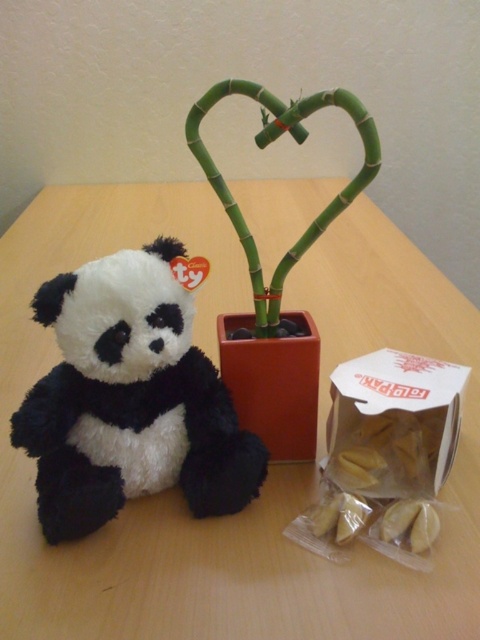
You are a child sitting at the table and want to reach both the black plush panda at left and the green bamboo at center. Which object will your hand touch first as you reach out?

The black plush panda at left will be touched first because it is closer to you than the green bamboo at center.

You are a delivery robot with a package that is 30 centimeters wide. You need to place it on the wooden table at center without moving the black plush panda at left. Is there enough space between them for the package?

The distance between the wooden table at center and the black plush panda at left is 32.93 centimeters. Since the package is 30 centimeters wide, there is enough space to place it on the wooden table at center without moving the black plush panda at left.

You have a small vase that is 10 cm in diameter. You want to place it on the wooden table at center. Can the matte orange pot at center fit on the same table without overlapping the vase?

The wooden table at center might be wider than matte orange pot at center, so there might be enough space for both the vase and the pot to be placed without overlapping.